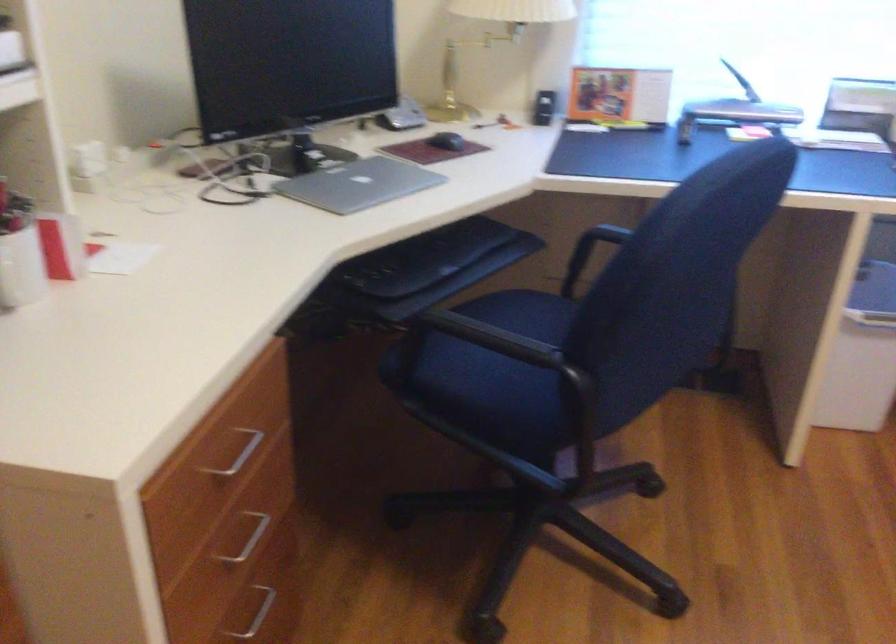
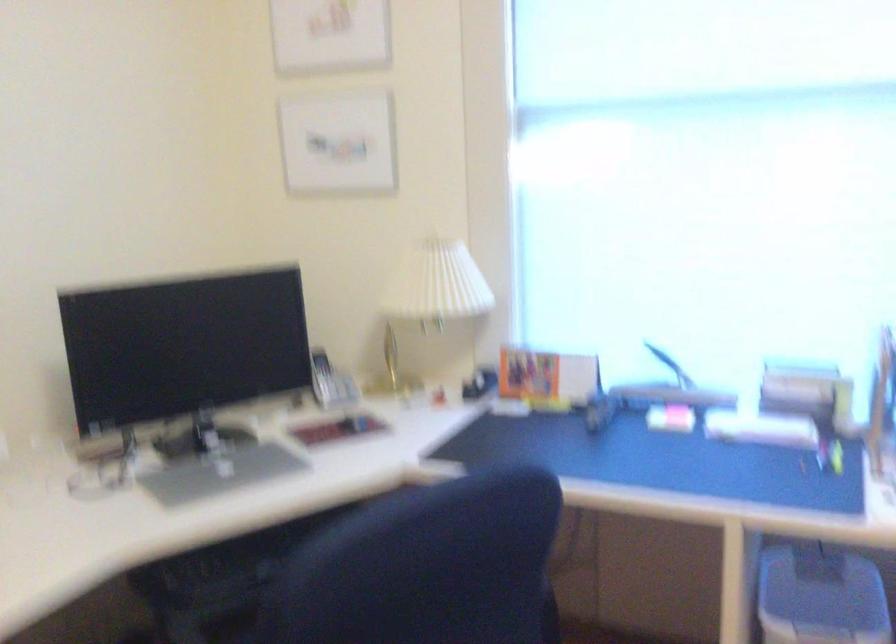
In the second image, find the point that corresponds to (398,102) in the first image.

(330, 382)